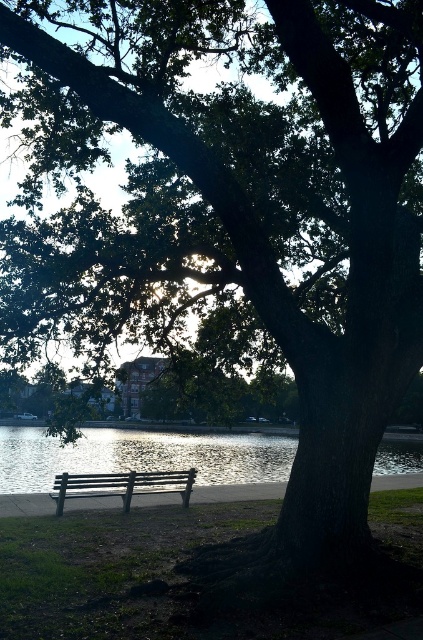
Between point (170, 451) and point (79, 483), which one is positioned in front?

Positioned in front is point (79, 483).

Does glistening water at bench left have a greater width compared to black wooden bench at lower center?

Correct, the width of glistening water at bench left exceeds that of black wooden bench at lower center.

Is point (99, 435) closer to camera compared to point (137, 490)?

No, it is behind (137, 490).

Locate an element on the screen. This screenshot has width=423, height=640. glistening water at bench left is located at coordinates (140, 456).